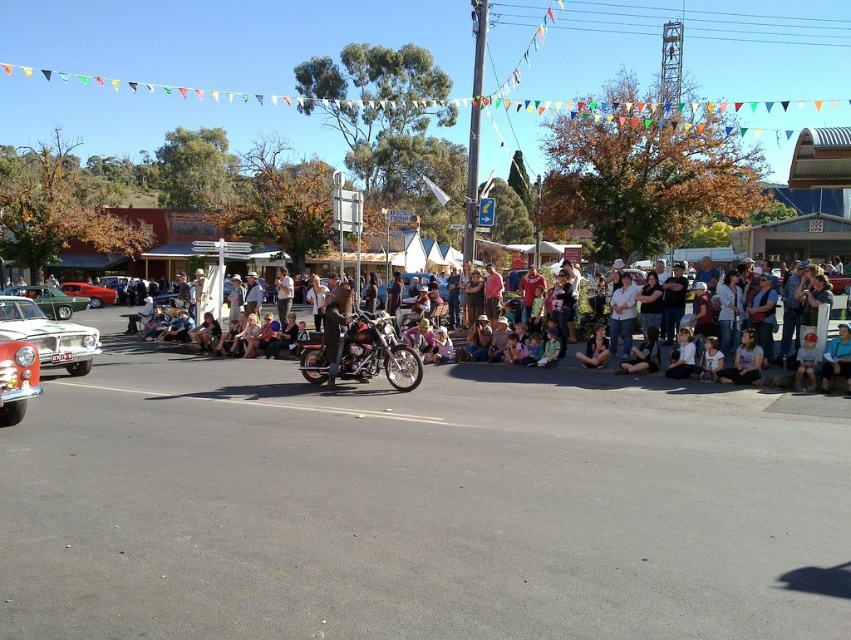
Question: Is metallic green car at left bigger than denim jacket at lower center?

Choices:
 (A) yes
 (B) no

Answer: (B)

Question: Based on their relative distances, which object is farther from the white glossy car at left?

Choices:
 (A) shiny red car at left
 (B) shiny chrome car at lower left
 (C) denim jacket at lower right
 (D) denim jacket at lower center

Answer: (A)

Question: Which point appears closest to the camera in this image?

Choices:
 (A) [786, 376]
 (B) [90, 300]
 (C) [33, 385]

Answer: (C)

Question: Which object appears farthest from the camera in this image?

Choices:
 (A) metallic green car at left
 (B) white cotton shirt at lower right
 (C) matte black motorcycle at center

Answer: (A)

Question: Does shiny chrome motorcycle at center appear on the left side of denim jacket at lower center?

Choices:
 (A) no
 (B) yes

Answer: (B)

Question: Does light blue denim jeans at lower center have a lesser width compared to denim jacket at lower center?

Choices:
 (A) no
 (B) yes

Answer: (B)